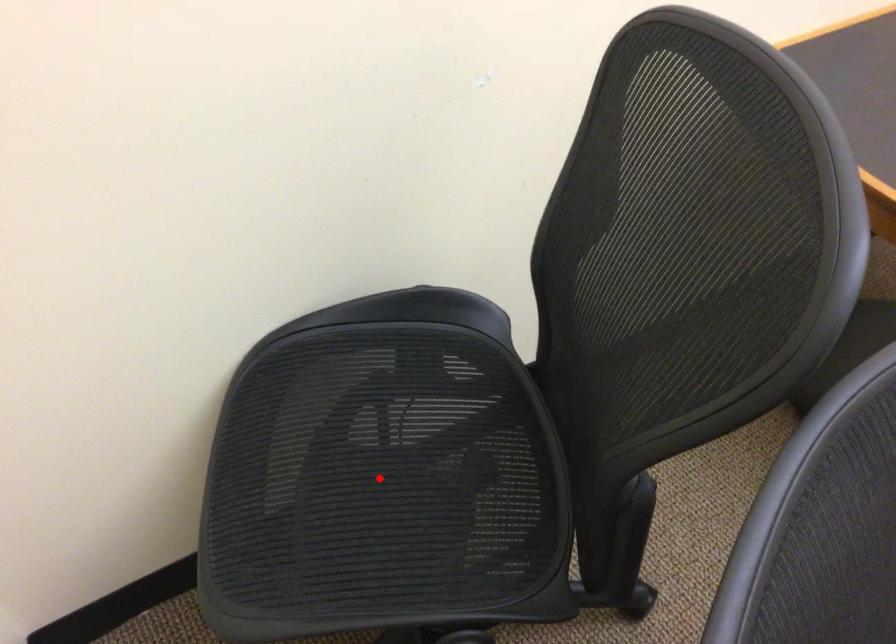
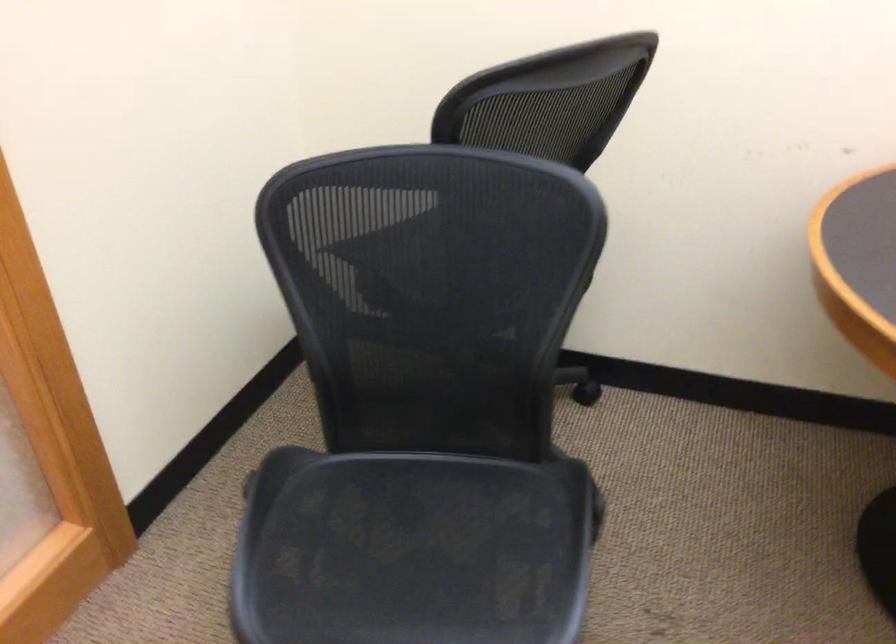
Question: I am providing you with two images of the same scene from different viewpoints. A red point is marked on the first image. Can you still see the location of the red point in image 2?

Choices:
 (A) Yes
 (B) No

Answer: (B)